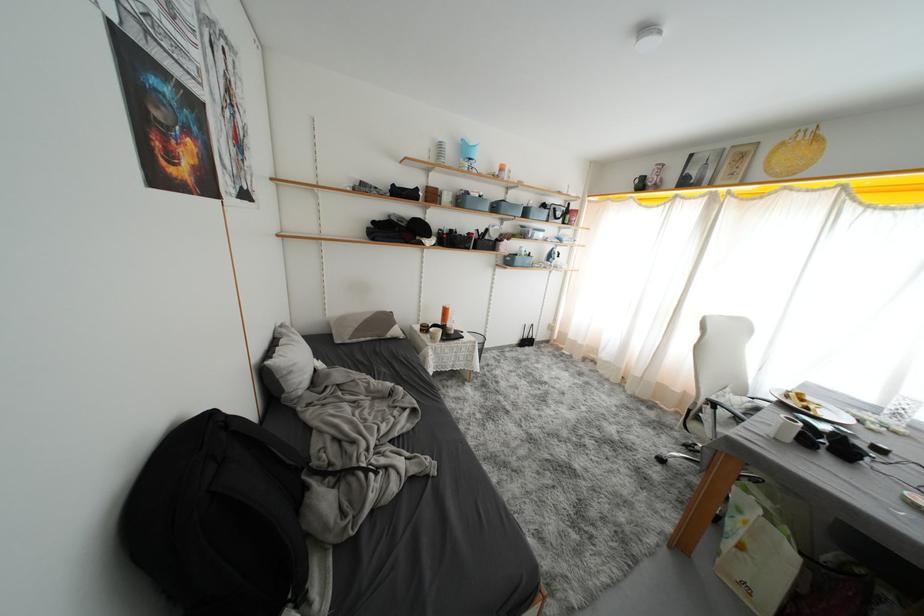
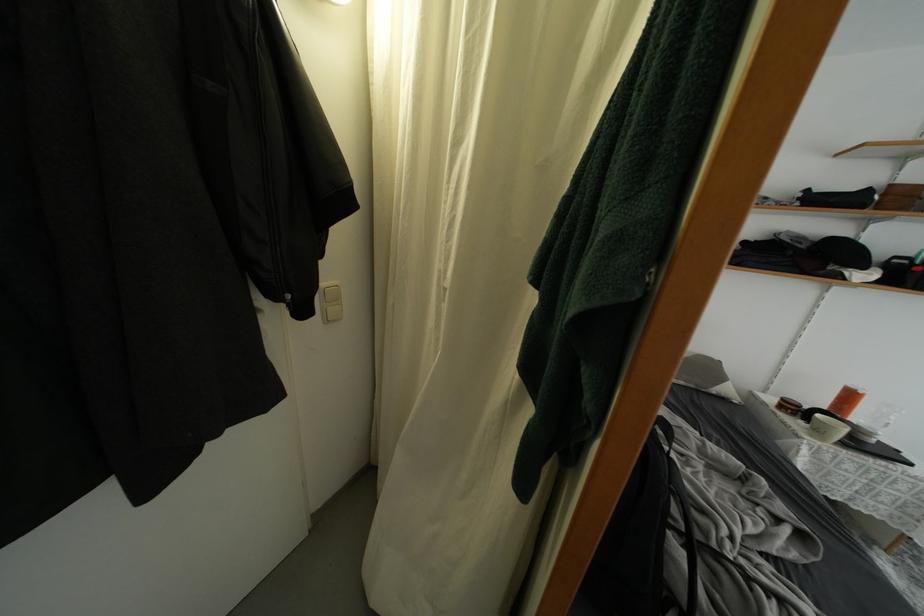
The point at (439, 342) is marked in the first image. Where is the corresponding point in the second image?

(823, 437)